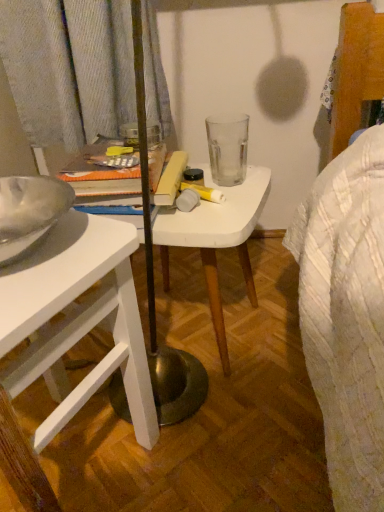
This screenshot has width=384, height=512. Find the location of `free space above white matte table at center (from a real-world perspective)`. free space above white matte table at center (from a real-world perspective) is located at coordinates (206, 193).